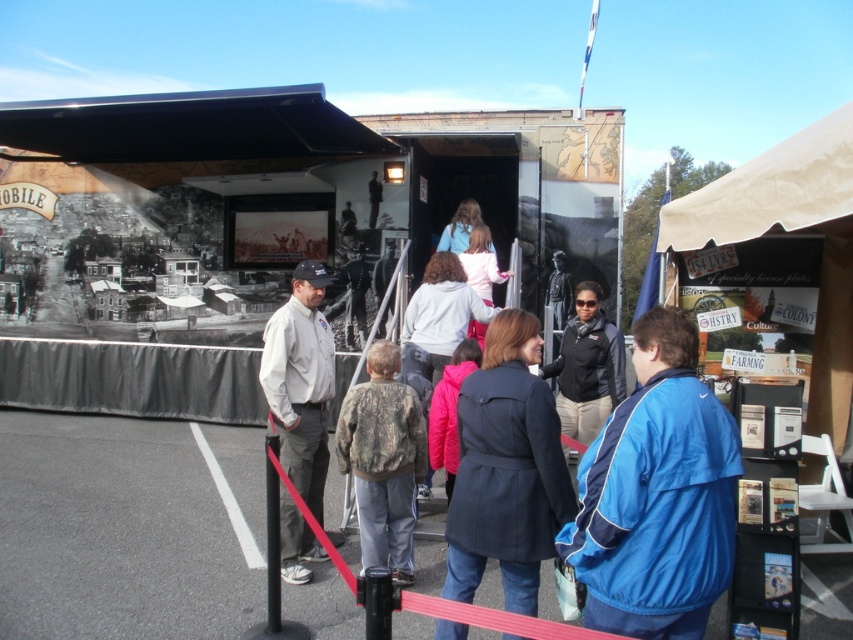
You are a photographer standing at the entrance of the trailer. You want to take a photo of both the dark blue coat at center and the black fleece jacket at center in the same frame. Can you fit both of them in your camera view if your camera has a 10 feet wide field of view?

The dark blue coat at center and black fleece jacket at center are 8.77 feet apart from each other. Since the distance between them is less than the camera field of view of 10 feet, both can be captured in the same frame.

You are standing in front of the mobile exhibit trailer and notice two jackets hanging on a rack near the entrance. The jackets are the dark blue coat at center and the camouflage jacket at center. Which jacket is positioned higher on the rack?

The dark blue coat at center is positioned higher on the rack than the camouflage jacket at center.

You are a photographer trying to capture a photo of the blue synthetic jacket at center and the black fleece jacket at center. Which jacket should you focus on if you want to include both in the frame without cropping the taller one?

The blue synthetic jacket at center is shorter than the black fleece jacket at center, so you should focus on the black fleece jacket at center to ensure it fits in the frame without cropping.